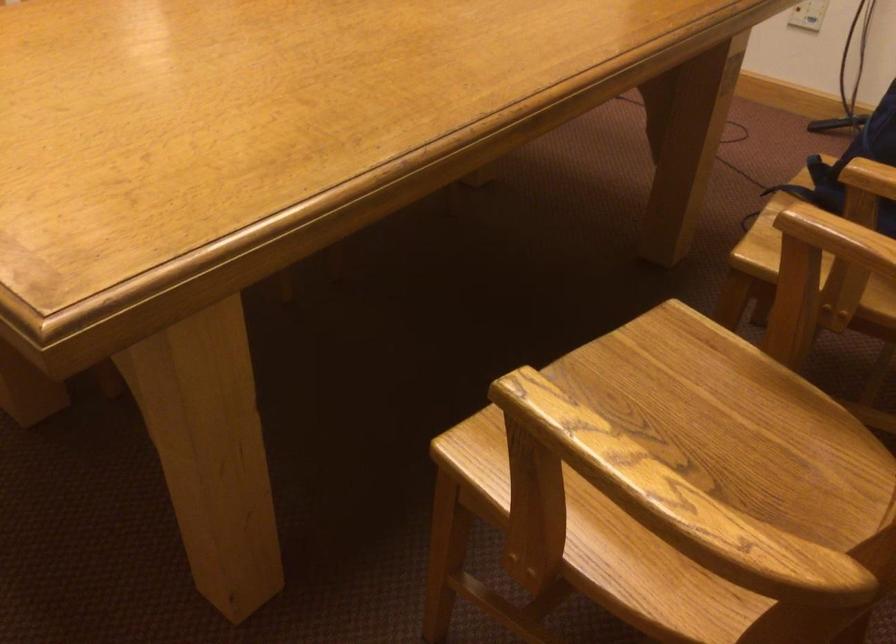
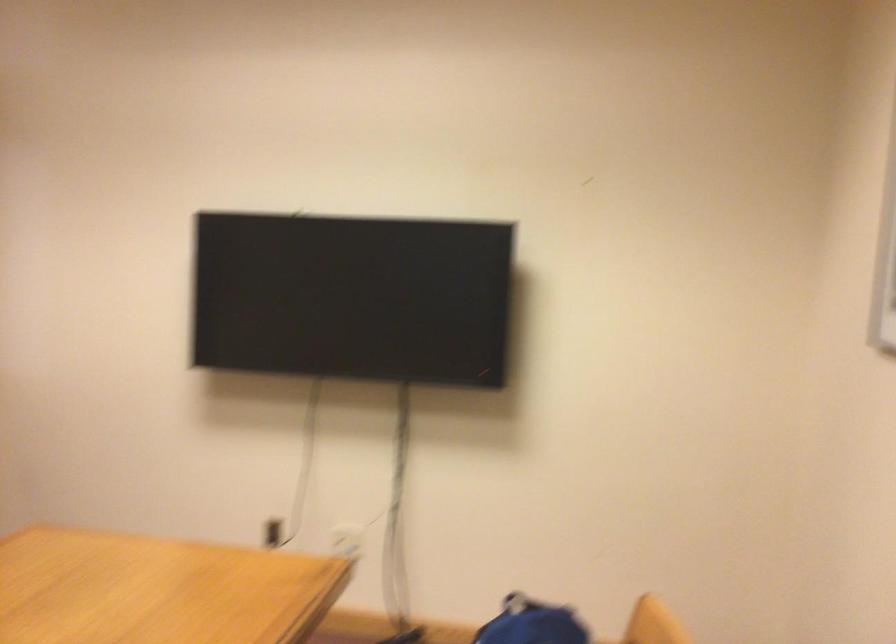
First-person continuous shooting, in which direction is the camera rotating?

The rotation direction of the camera is right-up.